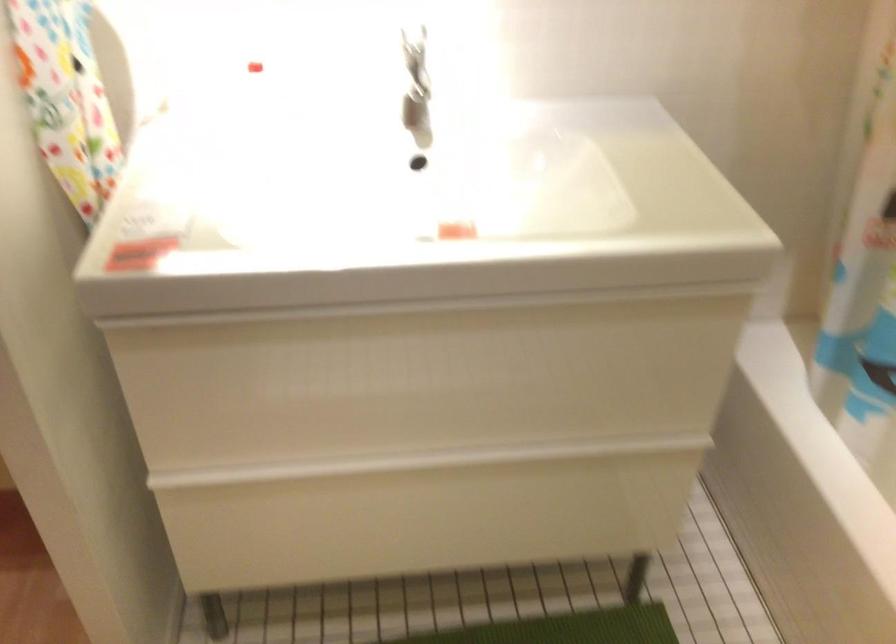
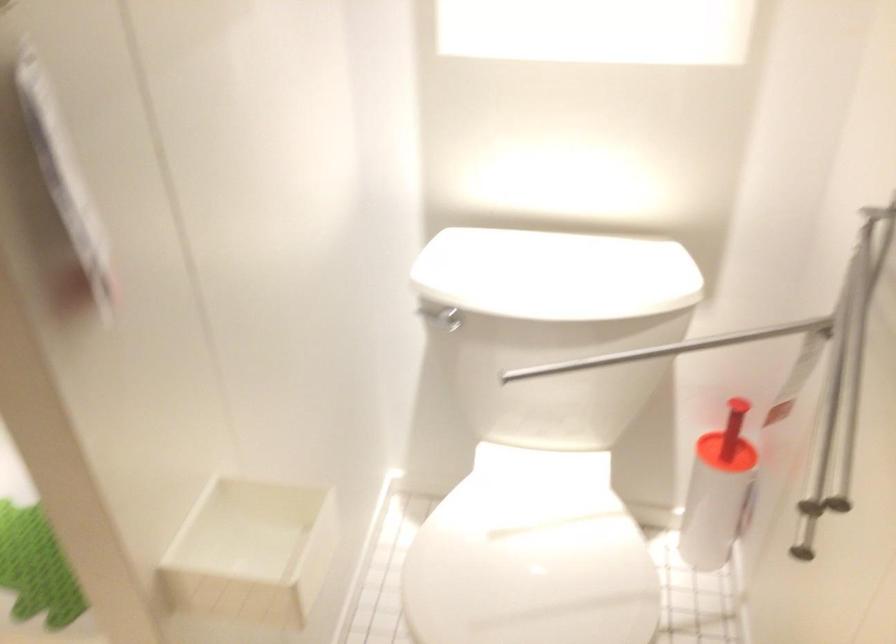
The images are taken continuously from a first-person perspective. In which direction is your viewpoint rotating?

The camera rotated toward right-down.